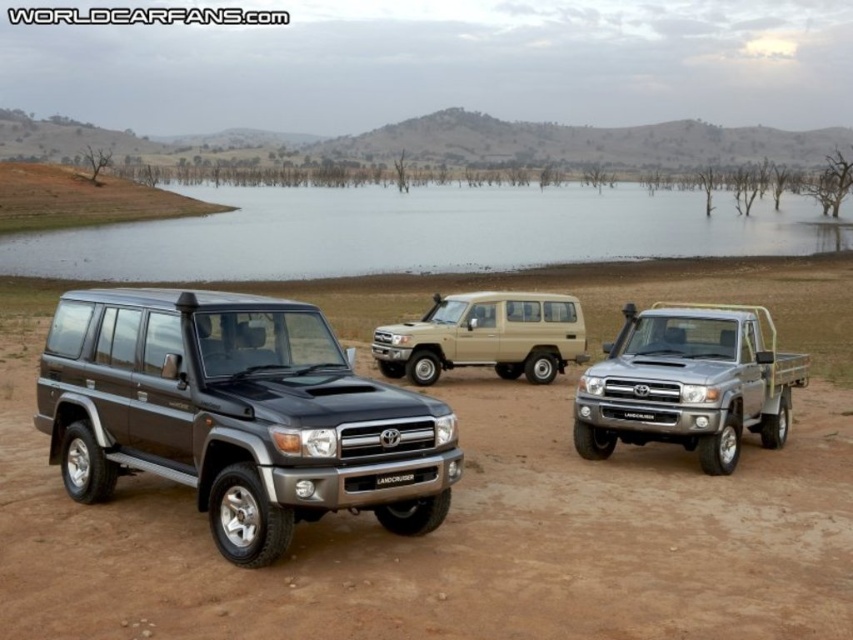
Question: Which object is closer to the camera taking this photo?

Choices:
 (A) clear water at lake center
 (B) brown matte dirt track at center
 (C) dark gray metallic suv at center
 (D) beige matte suv at center

Answer: (B)

Question: Is brown matte dirt track at center bigger than clear water at lake center?

Choices:
 (A) no
 (B) yes

Answer: (A)

Question: Does brown matte dirt track at center have a lesser width compared to clear water at lake center?

Choices:
 (A) yes
 (B) no

Answer: (A)

Question: Which is farther from the brown matte dirt track at center?

Choices:
 (A) beige matte suv at center
 (B) dark gray metallic suv at center
 (C) silver metallic truck at center
 (D) clear water at lake center

Answer: (D)

Question: Which point is farther to the camera?

Choices:
 (A) (633, 625)
 (B) (289, 324)

Answer: (B)

Question: Where is clear water at lake center located in relation to silver metallic truck at center in the image?

Choices:
 (A) above
 (B) below

Answer: (A)